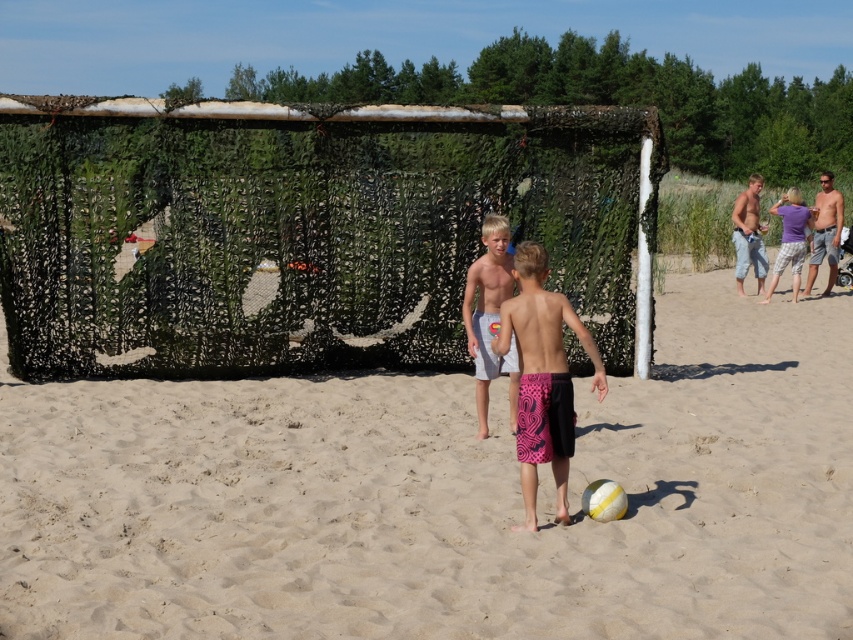
Is tan skin shirtless man at right shorter than purple cotton shirt at upper right?

Yes.

Is point (820, 220) in front of point (796, 211)?

No, it is not.

Between point (820, 184) and point (801, 216), which one is positioned behind?

The point (820, 184) is behind.

You are a GUI agent. You are given a task and a screenshot of the screen. Output one action in this format:
    pyautogui.click(x=<x>, y=<y>)
    Task: Click on the tan skin shirtless man at right
    This screenshot has height=640, width=853.
    Given the screenshot: What is the action you would take?
    pyautogui.click(x=825, y=232)

Who is more distant from viewer, (831, 246) or (606, 497)?

Point (831, 246)

The width and height of the screenshot is (853, 640). What are the coordinates of `tan skin shirtless man at right` in the screenshot? It's located at (825, 232).

Who is more forward, (825, 234) or (619, 513)?

Point (619, 513) is in front.

You are a GUI agent. You are given a task and a screenshot of the screen. Output one action in this format:
    pyautogui.click(x=<x>, y=<y>)
    Task: Click on the tan skin shirtless man at right
    The width and height of the screenshot is (853, 640).
    Given the screenshot: What is the action you would take?
    pyautogui.click(x=825, y=232)

Does pink patterned shorts at center have a greater height compared to tan skin shirtless man at right?

No.

Is pink patterned shorts at center thinner than tan skin shirtless man at right?

Correct, pink patterned shorts at center's width is less than tan skin shirtless man at right's.

Based on the photo, measure the distance between pink patterned shorts at center and camera.

pink patterned shorts at center and camera are 7.83 meters apart from each other.

Locate an element on the screen. Image resolution: width=853 pixels, height=640 pixels. pink patterned shorts at center is located at coordinates (543, 376).